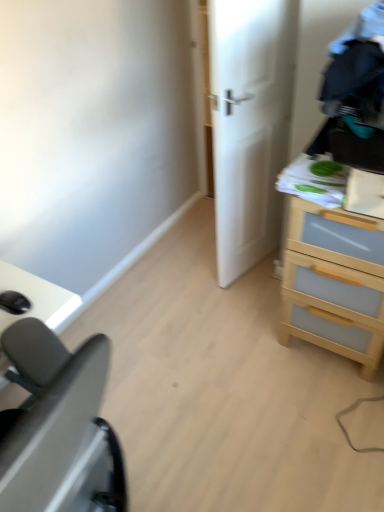
The image size is (384, 512). Identify the location of free region on the left part of light wood chest of drawers at right. (254, 346).